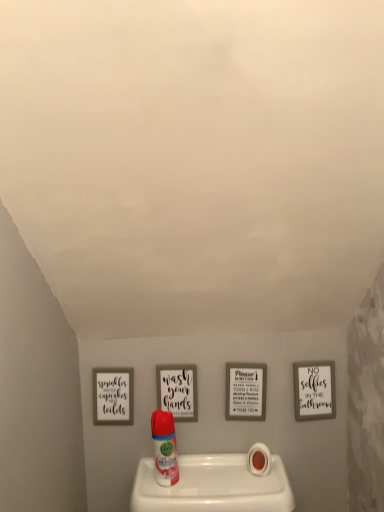
Question: Which direction should I rotate to look at translucent plastic air freshener at center?

Choices:
 (A) left
 (B) right

Answer: (A)

Question: Can you confirm if white matte toilet paper at lower center is bigger than translucent plastic air freshener at center?

Choices:
 (A) no
 (B) yes

Answer: (A)

Question: Considering the relative positions of white matte toilet paper at lower center and translucent plastic air freshener at center in the image provided, is white matte toilet paper at lower center to the right of translucent plastic air freshener at center from the viewer's perspective?

Choices:
 (A) no
 (B) yes

Answer: (B)

Question: Is white matte toilet paper at lower center positioned with its back to translucent plastic air freshener at center?

Choices:
 (A) no
 (B) yes

Answer: (A)

Question: Can you confirm if white matte toilet paper at lower center is wider than translucent plastic air freshener at center?

Choices:
 (A) yes
 (B) no

Answer: (A)

Question: From a real-world perspective, is white matte toilet paper at lower center positioned under translucent plastic air freshener at center based on gravity?

Choices:
 (A) no
 (B) yes

Answer: (B)

Question: Would you say white matte toilet paper at lower center is outside translucent plastic air freshener at center?

Choices:
 (A) no
 (B) yes

Answer: (B)

Question: Is the depth of translucent plastic air freshener at center greater than that of white matte toilet paper at lower center?

Choices:
 (A) yes
 (B) no

Answer: (B)

Question: From a real-world perspective, does translucent plastic air freshener at center sit lower than white matte toilet paper at lower center?

Choices:
 (A) yes
 (B) no

Answer: (B)

Question: Considering the relative sizes of translucent plastic air freshener at center and white matte toilet paper at lower center in the image provided, is translucent plastic air freshener at center taller than white matte toilet paper at lower center?

Choices:
 (A) yes
 (B) no

Answer: (A)

Question: Is translucent plastic air freshener at center to the right of white matte toilet paper at lower center from the viewer's perspective?

Choices:
 (A) yes
 (B) no

Answer: (B)

Question: Does translucent plastic air freshener at center turn towards white matte toilet paper at lower center?

Choices:
 (A) no
 (B) yes

Answer: (A)

Question: From the image's perspective, is translucent plastic air freshener at center located above white matte toilet paper at lower center?

Choices:
 (A) no
 (B) yes

Answer: (B)

Question: Considering the positions of translucent plastic air freshener at center and white matte toilet paper at lower center in the image, is translucent plastic air freshener at center wider or thinner than white matte toilet paper at lower center?

Choices:
 (A) wide
 (B) thin

Answer: (B)